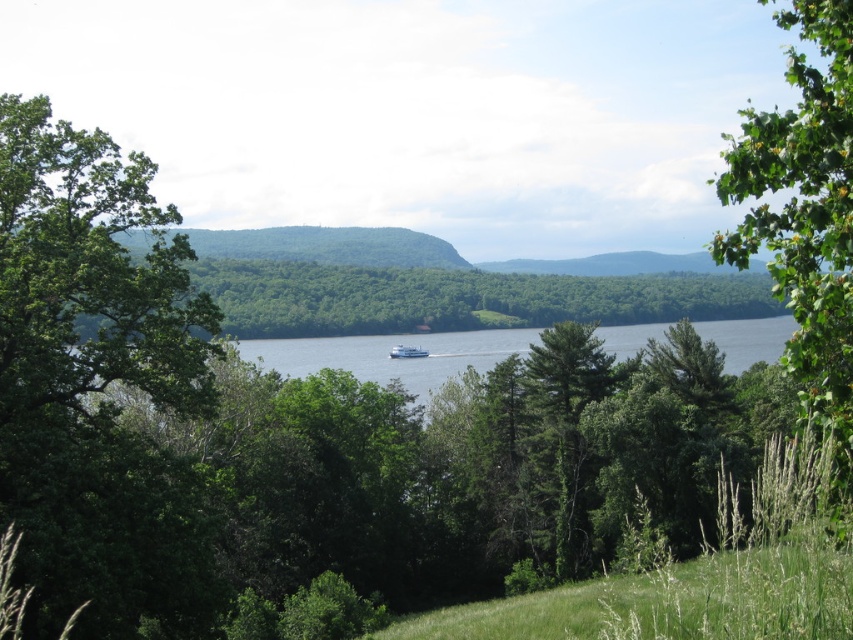
You are standing in the middle of the grassy area and want to walk to the small boat on the water. Which direction should you go to avoid walking between the green leafy tree at left and the green leafy tree at right?

To avoid walking between the green leafy tree at left and the green leafy tree at right, you should go towards the direction where the boat is positioned, which is slightly off center towards the middle. Since the trees are positioned left and right, moving towards the center avoids the path between them.

You are standing at the center of the grassy area and want to walk towards the small boat on the water. Which direction should you go to avoid walking between the green leafy tree at left and the green leafy tree at right?

The green leafy tree at left is below the green leafy tree at right, so to avoid walking between them, you should walk towards the direction where neither tree blocks your path. Since the left tree is lower, moving towards the right side might keep you clear of both.

You are standing at the center of the grassy area and want to take a photo of both the green leafy tree at left and the green leafy tree at right in the same frame. Which tree should you position closer to the camera to ensure both are fully visible?

Since the green leafy tree at left is shorter than the green leafy tree at right, you should position yourself closer to the taller green leafy tree at right to include both trees in the frame.